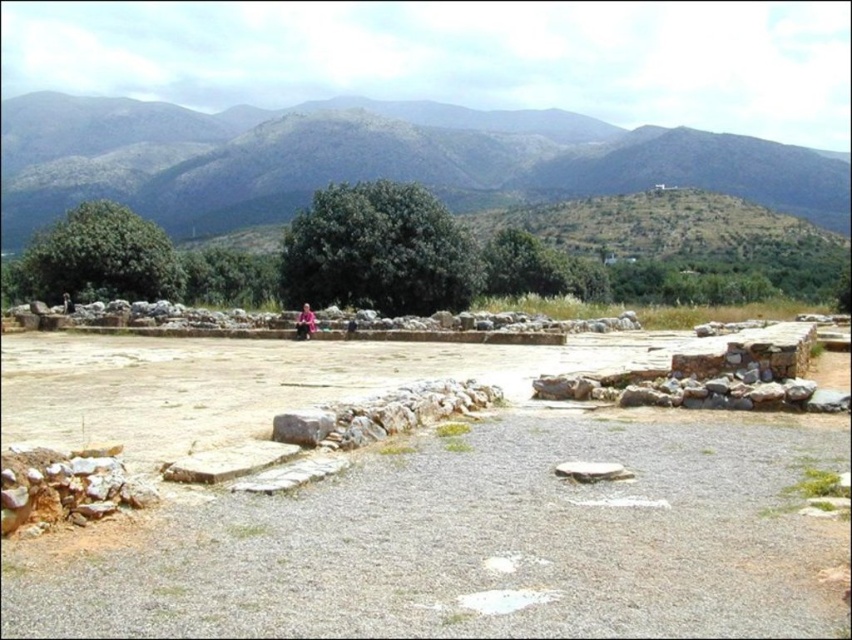
Which is more to the left, green leafy tree at center or dark brown leather jacket at upper left?

dark brown leather jacket at upper left

Is green leafy tree at center to the right of dark brown leather jacket at upper left from the viewer's perspective?

Yes, green leafy tree at center is to the right of dark brown leather jacket at upper left.

Is point (309, 234) farther from camera compared to point (62, 304)?

No, (309, 234) is closer to viewer.

Where is `green leafy tree at center`? green leafy tree at center is located at coordinates (378, 252).

Does dark brown leather jacket at upper left appear on the right side of dark blue fabric at center?

No, dark brown leather jacket at upper left is not to the right of dark blue fabric at center.

Can you confirm if dark brown leather jacket at upper left is thinner than dark blue fabric at center?

No, dark brown leather jacket at upper left is not thinner than dark blue fabric at center.

Image resolution: width=852 pixels, height=640 pixels. I want to click on dark brown leather jacket at upper left, so click(x=67, y=301).

Is point (202, 182) behind point (298, 320)?

That is True.

Between green grassy hill at upper center and pink fabric person at center, which one appears on the left side from the viewer's perspective?

pink fabric person at center is more to the left.

Who is more forward, (60, 193) or (297, 321)?

Point (297, 321) is in front.

I want to click on green grassy hill at upper center, so click(370, 157).